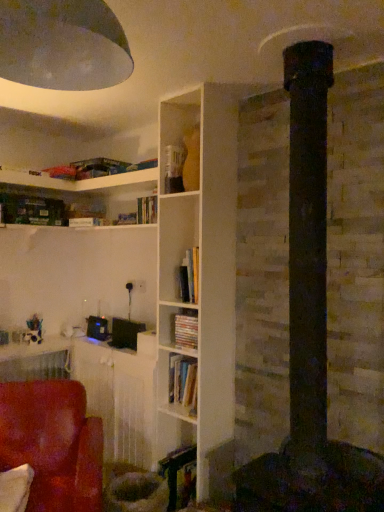
Question: Can you confirm if metallic dome at upper left is positioned to the right of matte cardboard book at center?

Choices:
 (A) no
 (B) yes

Answer: (A)

Question: From the image's perspective, is metallic dome at upper left on matte cardboard book at center?

Choices:
 (A) no
 (B) yes

Answer: (B)

Question: Is metallic dome at upper left smaller than matte cardboard book at center?

Choices:
 (A) no
 (B) yes

Answer: (A)

Question: Can you confirm if metallic dome at upper left is taller than matte cardboard book at center?

Choices:
 (A) yes
 (B) no

Answer: (A)

Question: Can matte cardboard book at center be found inside metallic dome at upper left?

Choices:
 (A) yes
 (B) no

Answer: (B)

Question: Does point (11, 457) appear closer or farther from the camera than point (187, 346)?

Choices:
 (A) farther
 (B) closer

Answer: (B)

Question: Is suede-like red chair at lower left taller or shorter than matte cardboard book at center?

Choices:
 (A) short
 (B) tall

Answer: (B)

Question: Would you say suede-like red chair at lower left is to the left or to the right of matte cardboard book at center in the picture?

Choices:
 (A) right
 (B) left

Answer: (B)

Question: Choose the correct answer: Is suede-like red chair at lower left inside matte cardboard book at center or outside it?

Choices:
 (A) inside
 (B) outside

Answer: (B)

Question: From a real-world perspective, relative to metallic dome at upper left, is suede-like red chair at lower left vertically above or below?

Choices:
 (A) below
 (B) above

Answer: (A)

Question: Is suede-like red chair at lower left spatially inside metallic dome at upper left, or outside of it?

Choices:
 (A) inside
 (B) outside

Answer: (B)

Question: Considering the positions of point (94, 484) and point (99, 88), is point (94, 484) closer or farther from the camera than point (99, 88)?

Choices:
 (A) farther
 (B) closer

Answer: (A)

Question: In terms of width, does suede-like red chair at lower left look wider or thinner when compared to metallic dome at upper left?

Choices:
 (A) thin
 (B) wide

Answer: (B)

Question: From the image's perspective, relative to wooden table at lower left, is matte cardboard book at center above or below?

Choices:
 (A) above
 (B) below

Answer: (A)

Question: From a real-world perspective, is matte cardboard book at center above or below wooden table at lower left?

Choices:
 (A) below
 (B) above

Answer: (B)